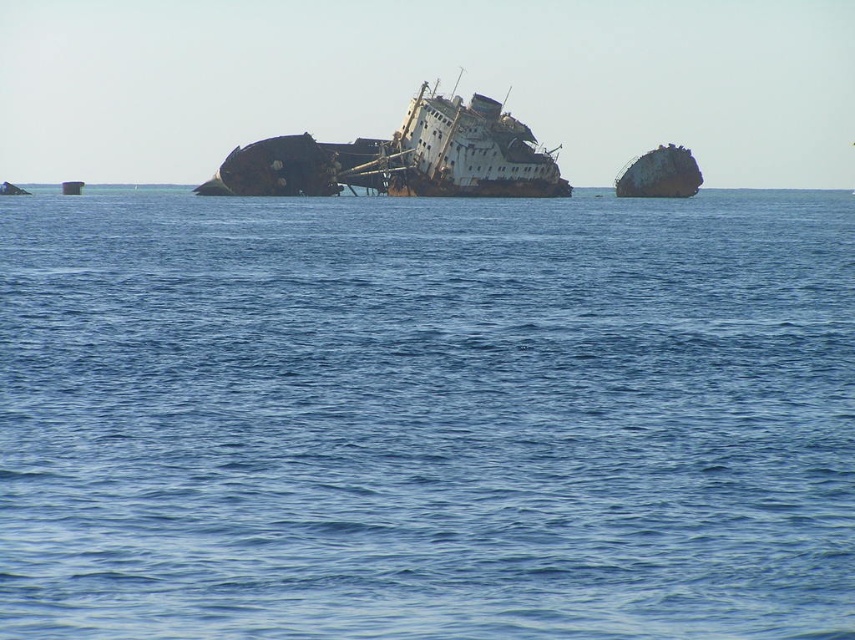
You are a marine archaeologist planning to document two shipwrecks in the area. You have a drone that can only capture images of objects wider than 10 meters. Based on the scene, will both rusty metal shipwreck at center and rusty metal shipwreck at right be captured by the drone?

The rusty metal shipwreck at center is wider than the rusty metal shipwreck at right. Since the drone requires objects to be wider than 10 meters, and the center shipwreck is wider, it likely meets the requirement. However, the smaller shipwreck at right might not be wide enough. Without exact measurements, we can only infer the center one qualifies, but the right one may not.

You are a marine biologist planning to dive between the blue water at center and the rusty metal shipwreck at right. Which one is wider in terms of horizontal span?

The blue water at center is wider than the rusty metal shipwreck at right, so the blue water at center has a greater horizontal span.

You are a marine biologist studying underwater structures. You observe the blue water at center and the rusty metal shipwreck at center. Which object is positioned lower in the scene?

The blue water at center is below the rusty metal shipwreck at center, so it is positioned lower in the scene.